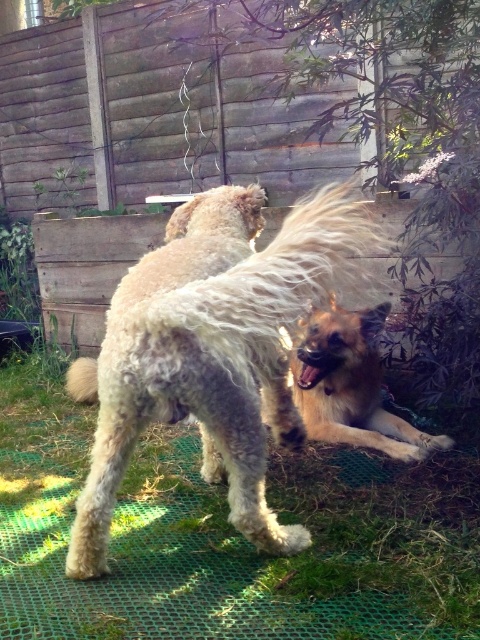
You are standing 5 feet away from the fuzzy beige dog at center. You want to throw a ball to the dog. Can you reach the dog with your throw?

The fuzzy beige dog at center is 3.85 feet from camera. Since you are standing 5 feet away, you can reach the dog with your throw because the distance is within your throwing range.

From the picture: You are a photographer setting up a camera to capture the interaction between the fuzzy beige dog at center and the golden brown fur at lower right. Given that the minimum focus distance of your camera is 50 centimeters, will you need to adjust your position to ensure both dogs are in focus?

The fuzzy beige dog at center and the golden brown fur at lower right are 47.39 centimeters apart from each other. Since the distance between them is less than the camera minimum focus distance of 50 centimeters, you will need to adjust your position to ensure both are in focus.

Consider the image. You are standing in the backyard and want to place a small toy between the two points, point (328,600) and point (345,220). Which point is closer to you where you should place the toy first?

Point (345,220) is closer to you, so you should place the toy near that point first.